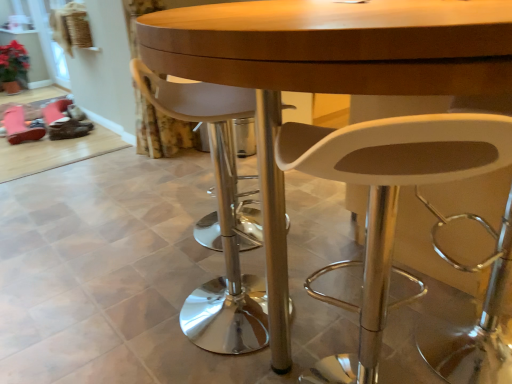
Question: From the image's perspective, does transparent glass door at upper left appear lower than floral fabric curtain at lower left?

Choices:
 (A) yes
 (B) no

Answer: (B)

Question: Could you tell me if transparent glass door at upper left is facing floral fabric curtain at lower left?

Choices:
 (A) no
 (B) yes

Answer: (A)

Question: Does transparent glass door at upper left have a greater height compared to floral fabric curtain at lower left?

Choices:
 (A) yes
 (B) no

Answer: (B)

Question: Is transparent glass door at upper left positioned in front of floral fabric curtain at lower left?

Choices:
 (A) yes
 (B) no

Answer: (B)

Question: Is transparent glass door at upper left far away from floral fabric curtain at lower left?

Choices:
 (A) no
 (B) yes

Answer: (B)

Question: Is floral fabric curtain at lower left located within transparent glass door at upper left?

Choices:
 (A) yes
 (B) no

Answer: (B)

Question: From the image's perspective, is pink suede shoe at lower left above floral fabric curtain at lower left?

Choices:
 (A) no
 (B) yes

Answer: (A)

Question: Is pink suede shoe at lower left bigger than floral fabric curtain at lower left?

Choices:
 (A) no
 (B) yes

Answer: (A)

Question: Does pink suede shoe at lower left turn towards floral fabric curtain at lower left?

Choices:
 (A) yes
 (B) no

Answer: (B)

Question: Considering the relative positions of pink suede shoe at lower left and floral fabric curtain at lower left in the image provided, is pink suede shoe at lower left behind floral fabric curtain at lower left?

Choices:
 (A) no
 (B) yes

Answer: (B)

Question: Is pink suede shoe at lower left smaller than floral fabric curtain at lower left?

Choices:
 (A) no
 (B) yes

Answer: (B)

Question: Is pink suede shoe at lower left wider than floral fabric curtain at lower left?

Choices:
 (A) yes
 (B) no

Answer: (A)

Question: From a real-world perspective, does white plastic chair at center, which appears as the second chair when viewed from the left, stand above pink suede shoe at lower left?

Choices:
 (A) yes
 (B) no

Answer: (A)